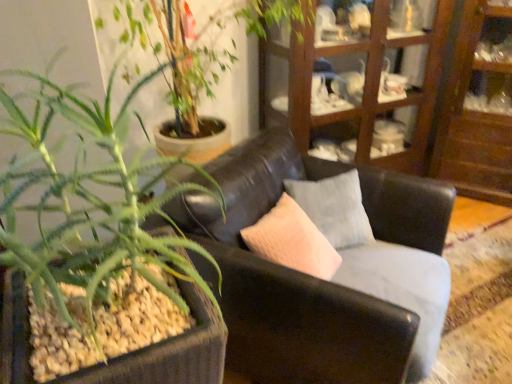
Question: Is wooden cabinet at upper right wider or thinner than black leather couch at center?

Choices:
 (A) wide
 (B) thin

Answer: (B)

Question: Based on their positions, is wooden cabinet at upper right located to the left or right of black leather couch at center?

Choices:
 (A) right
 (B) left

Answer: (A)

Question: Estimate the real-world distances between objects in this image. Which object is farther from the green succulent at left?

Choices:
 (A) wooden cabinet at upper right
 (B) wooden cabinet at upper right
 (C) black leather couch at center

Answer: (B)

Question: Which object is positioned closest to the green succulent at left?

Choices:
 (A) wooden cabinet at upper right
 (B) wooden cabinet at upper right
 (C) black leather couch at center

Answer: (C)